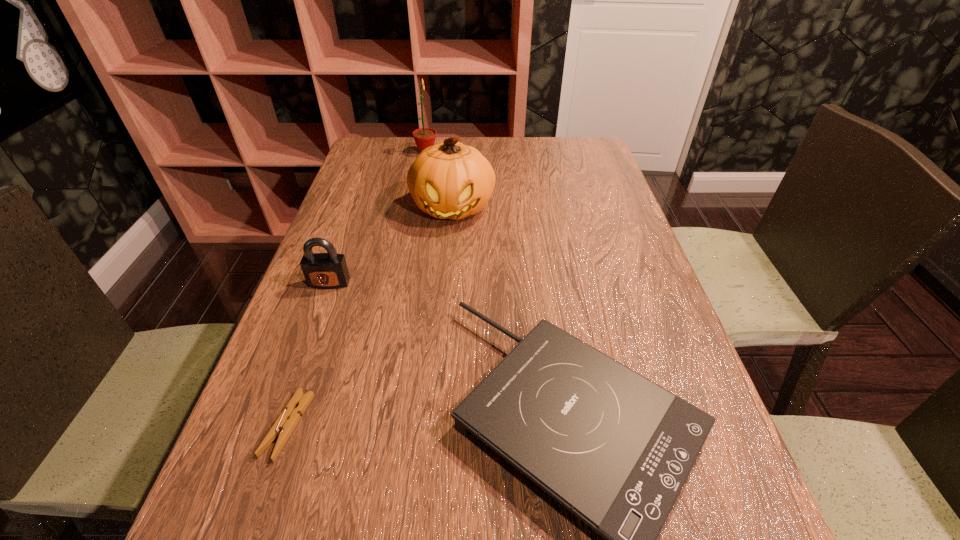
Where is `free point that satisfies the following two spatial constraints: 1. on the front of the clothespin near the keyhole; 2. on the left side of the third nearest object`? The image size is (960, 540). free point that satisfies the following two spatial constraints: 1. on the front of the clothespin near the keyhole; 2. on the left side of the third nearest object is located at coordinates (277, 426).

Image resolution: width=960 pixels, height=540 pixels. In order to click on vacant region that satisfies the following two spatial constraints: 1. on the face of the sunflower; 2. on the front of the third farthest object near the keyhole in this screenshot , I will do `click(401, 283)`.